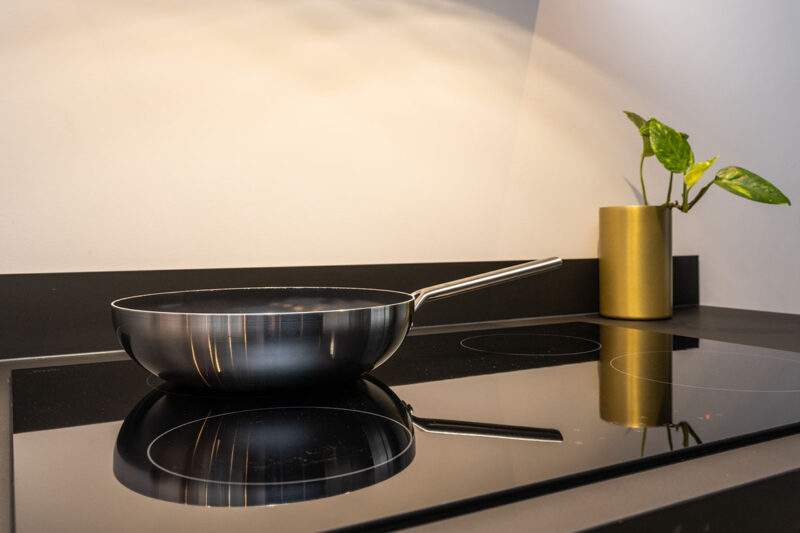
Locate an element on the screen. This screenshot has height=533, width=800. gold, tall, tubular plant pot is located at coordinates (650, 257).